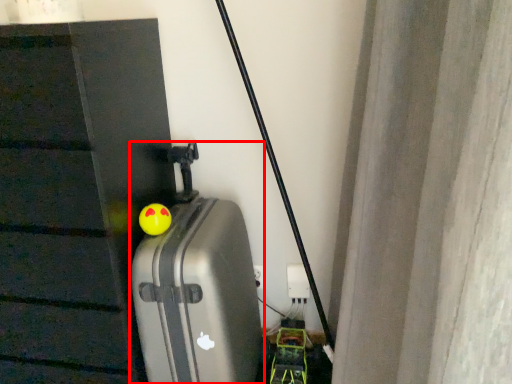
Question: From the image's perspective, considering the relative positions of suitcase (annotated by the red box) and toy in the image provided, where is suitcase (annotated by the red box) located with respect to the staircase?

Choices:
 (A) below
 (B) above

Answer: (A)